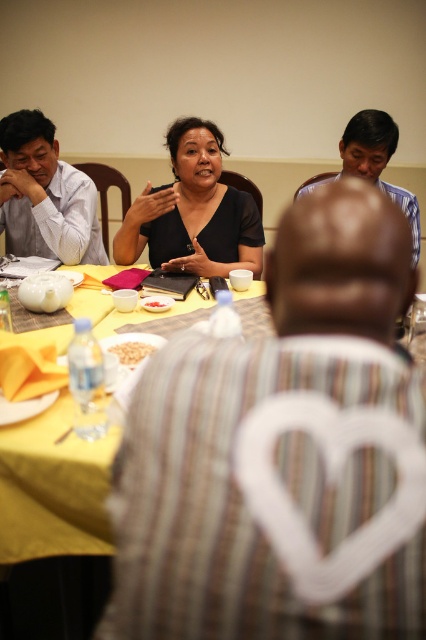
You are planning to place a rectangular box on the yellow fabric table at center. The box is as wide as the blue striped shirt at upper right. Will the box fit on the table without overhanging the edges?

The yellow fabric table at center is thinner than the blue striped shirt at upper right. Since the box is as wide as the blue striped shirt at upper right, the table is narrower than the box, so the box will overhang the edges of the table.

You are a photographer setting up for a group photo. You need to place a small microphone exactly halfway between the black matte dress at center and the white crumbly food at center. How far apart should you position the microphone from each object?

The microphone should be placed exactly halfway between the black matte dress at center and the white crumbly food at center, so it should be positioned 40.5 centimeters away from each object.

You are a photographer who wants to take a closeup shot of the white crumbly food at center without the black matte dress at center blocking the view. Is it possible to do so given their sizes?

The black matte dress at center is bigger than white crumbly food at center, so it might block the view. However, since the dress is at the center and the food is also at the center, adjusting the angle or zoom could allow focusing on the smaller white crumbly food at center while minimizing the dress obstruction.